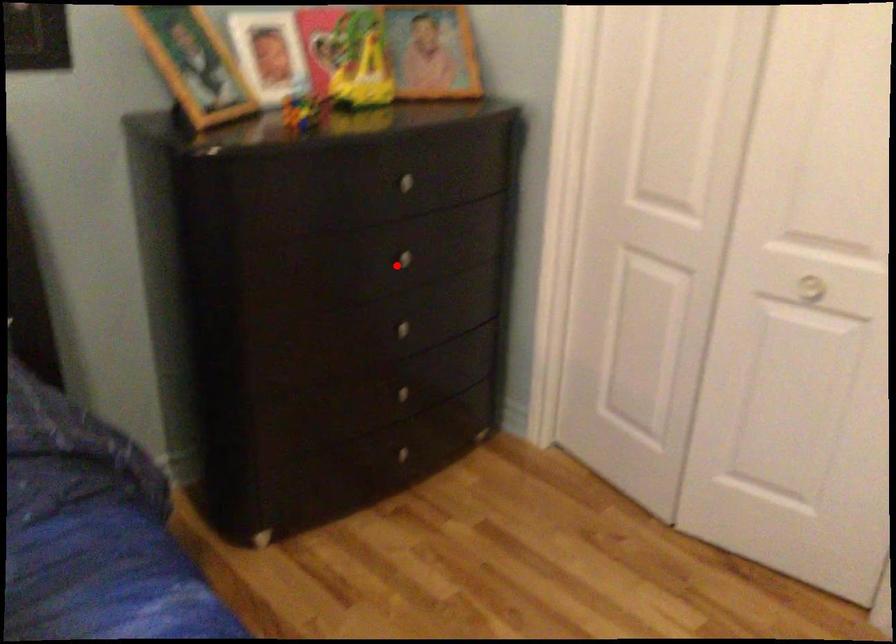
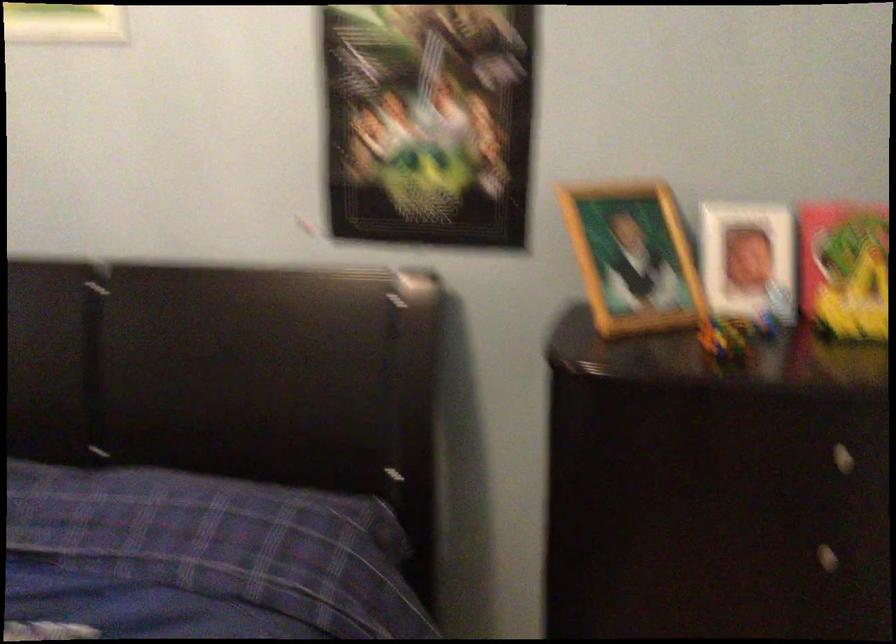
Question: A red point is marked in image1. In image2, is the corresponding 3D point closer to the camera or farther? Reply with the corresponding letter.

Choices:
 (A) The corresponding 3D point is closer.
 (B) The corresponding 3D point is farther.

Answer: (A)